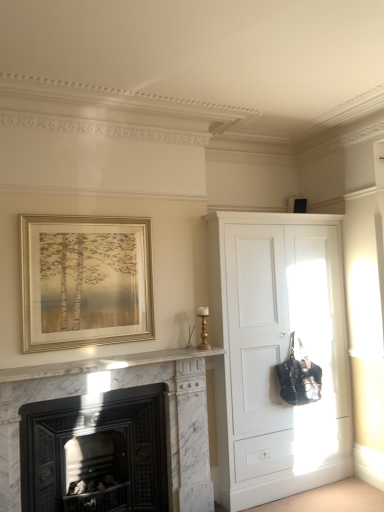
Question: Relative to white matte cupboard at right, is gold metallic frame at upper left in front or behind?

Choices:
 (A) behind
 (B) front

Answer: (B)

Question: In terms of size, does gold metallic frame at upper left appear bigger or smaller than white matte cupboard at right?

Choices:
 (A) small
 (B) big

Answer: (A)

Question: Which object is the farthest from the gold metallic frame at upper left?

Choices:
 (A) white matte cupboard at right
 (B) marble fireplace at lower left

Answer: (A)

Question: Which is farther from the gold metallic frame at upper left?

Choices:
 (A) marble fireplace at lower left
 (B) white matte cupboard at right

Answer: (B)